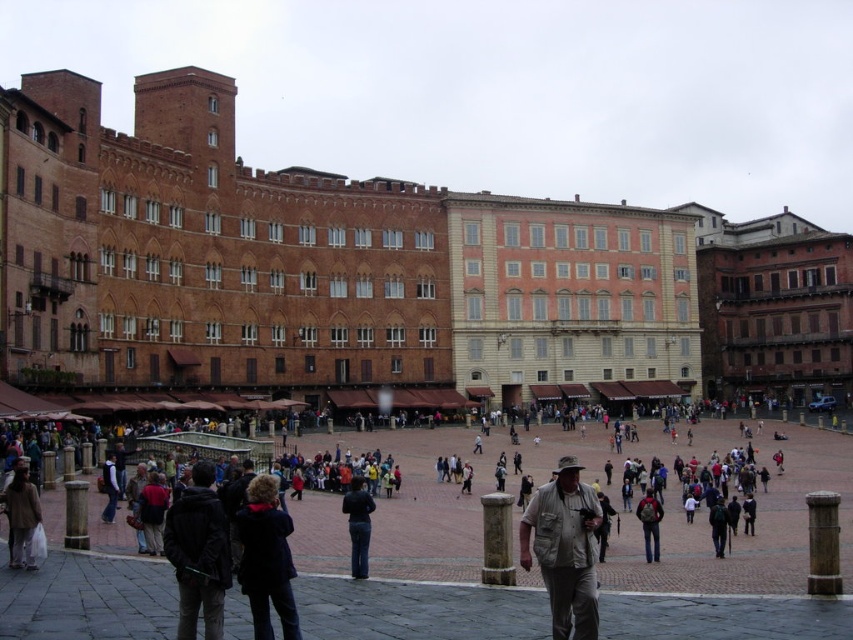
Can you confirm if dark gray jacket at lower left is positioned below light brown fabric jacket at lower left?

Indeed, dark gray jacket at lower left is positioned under light brown fabric jacket at lower left.

Measure the distance between dark gray jacket at lower left and light brown fabric jacket at lower left.

They are 26.52 feet apart.

Where is `dark gray jacket at lower left`? The image size is (853, 640). dark gray jacket at lower left is located at coordinates (198, 554).

Can you confirm if dark blue fabric coat at lower center is positioned above dark blue jeans at center?

Correct, dark blue fabric coat at lower center is located above dark blue jeans at center.

Does dark blue fabric coat at lower center have a lesser width compared to dark blue jeans at center?

Yes.

Find the location of `dark blue fabric coat at lower center`. dark blue fabric coat at lower center is located at coordinates pyautogui.click(x=265, y=557).

Does khaki fabric hat at center appear on the right side of dark blue fabric coat at lower center?

Indeed, khaki fabric hat at center is positioned on the right side of dark blue fabric coat at lower center.

Does point (552, 548) lie in front of point (236, 576)?

No, it is behind (236, 576).

Which is in front, point (583, 556) or point (251, 616)?

Positioned in front is point (583, 556).

At what (x,y) coordinates should I click in order to perform the action: click on khaki fabric hat at center. Please return your answer as a coordinate pair (x, y). The image size is (853, 640). Looking at the image, I should click on (564, 548).